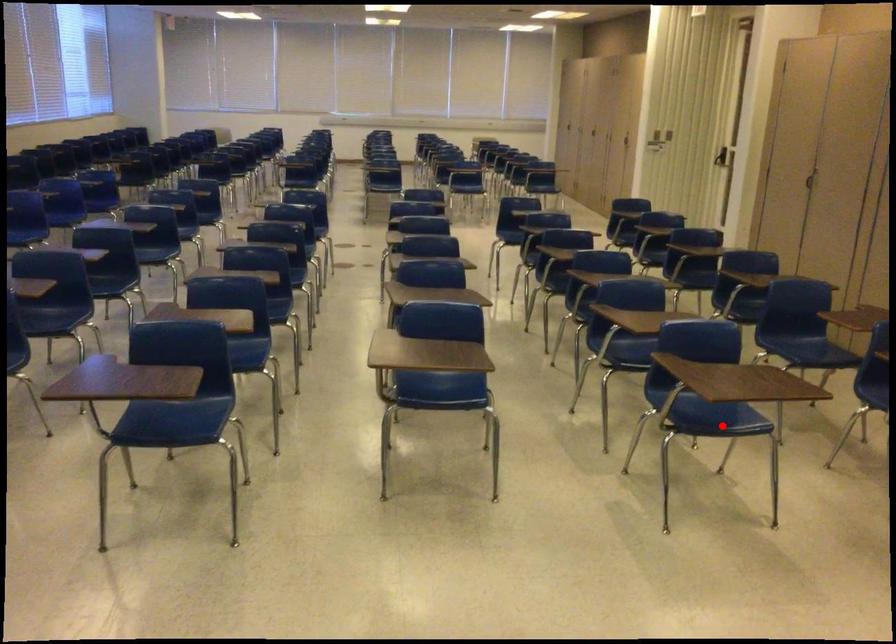
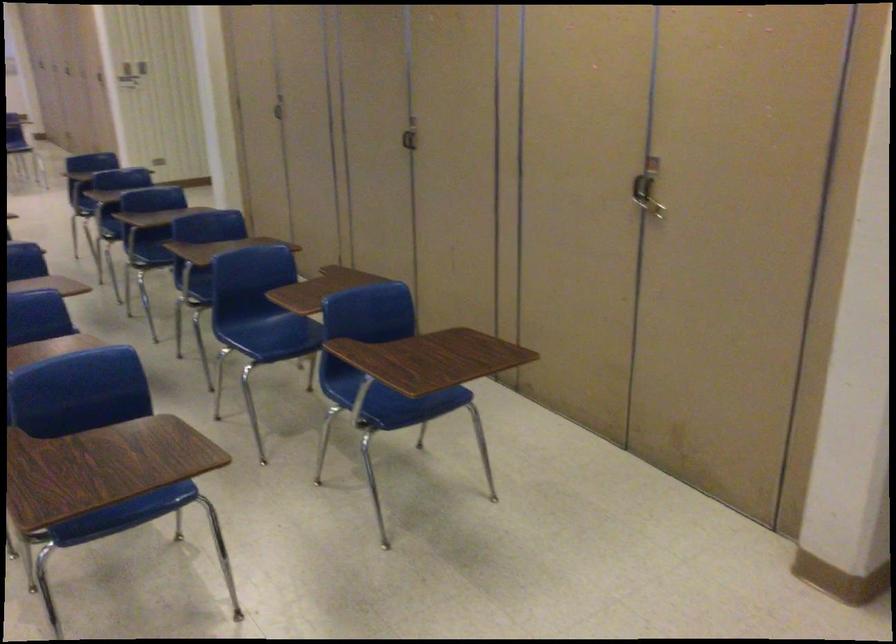
Find the pixel in the second image that matches the highlighted location in the first image.

(126, 516)